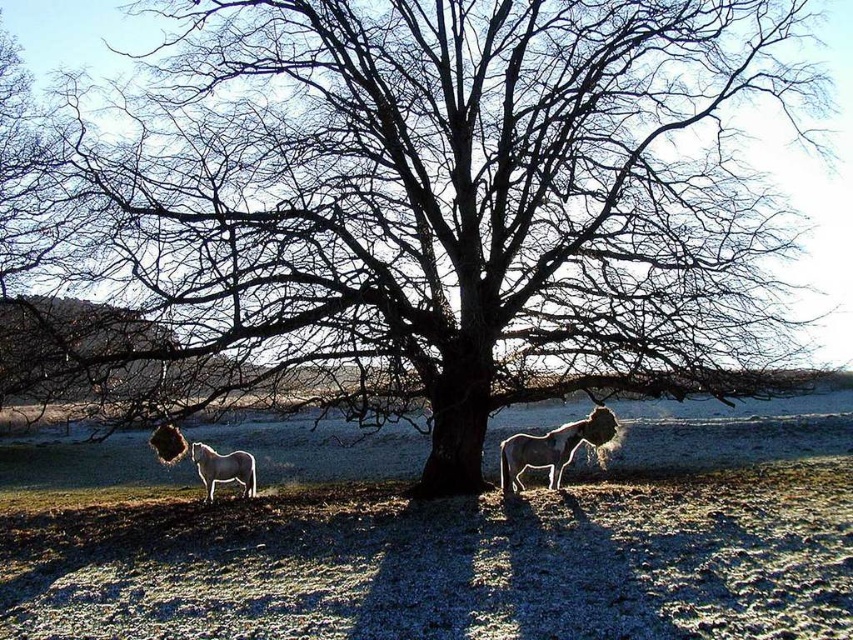
How distant is white glossy horse at center from white glossy horse at lower left?

They are 17.33 feet apart.

Consider the image. Does white glossy horse at center appear over white glossy horse at lower left?

Yes, white glossy horse at center is above white glossy horse at lower left.

Is point (578, 433) closer to camera compared to point (212, 493)?

Yes, it is.

At what (x,y) coordinates should I click in order to perform the action: click on white glossy horse at center. Please return your answer as a coordinate pair (x, y). This screenshot has height=640, width=853. Looking at the image, I should click on (552, 449).